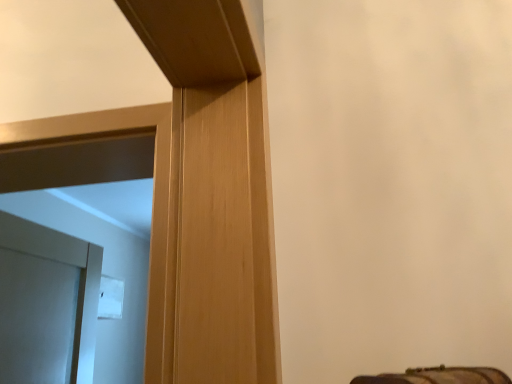
You are a GUI agent. You are given a task and a screenshot of the screen. Output one action in this format:
    pyautogui.click(x=<x>, y=<y>)
    Task: Click on the leather textured suitcase at lower right
    
    Given the screenshot: What is the action you would take?
    pyautogui.click(x=438, y=376)

Measure the distance between point (477, 376) and camera.

Point (477, 376) is 22.52 inches from camera.

The width and height of the screenshot is (512, 384). Describe the element at coordinates (438, 376) in the screenshot. I see `leather textured suitcase at lower right` at that location.

I want to click on leather textured suitcase at lower right, so click(x=438, y=376).